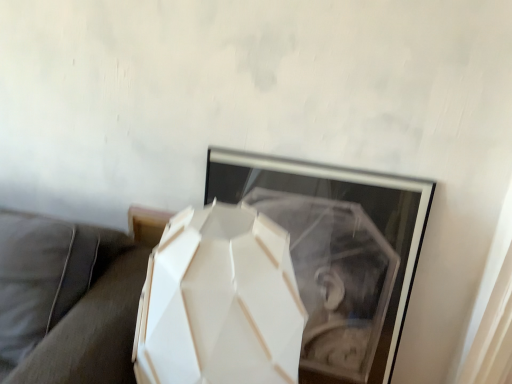
In order to face white matte geometric lamp at center, should I rotate leftwards or rightwards?

A 4.666 degree turn to the left will do.

What is the approximate height of white matte geometric lamp at center?

white matte geometric lamp at center is 36.00 inches tall.

Locate an element on the screen. This screenshot has width=512, height=384. white matte geometric lamp at center is located at coordinates (220, 302).

This screenshot has height=384, width=512. What do you see at coordinates (220, 302) in the screenshot? I see `white matte geometric lamp at center` at bounding box center [220, 302].

This screenshot has width=512, height=384. Describe the element at coordinates (67, 301) in the screenshot. I see `suede gray couch at lower left` at that location.

I want to click on suede gray couch at lower left, so click(67, 301).

Find the location of `white matte geometric lamp at center`. white matte geometric lamp at center is located at coordinates (220, 302).

Considering the positions of objects suede gray couch at lower left and white matte geometric lamp at center in the image provided, who is more to the right, suede gray couch at lower left or white matte geometric lamp at center?

white matte geometric lamp at center is more to the right.

Which object is further away from the camera taking this photo, suede gray couch at lower left or white matte geometric lamp at center?

suede gray couch at lower left is behind.

Does point (58, 382) come in front of point (270, 230)?

No, (58, 382) is behind (270, 230).

From the image's perspective, which object appears higher, suede gray couch at lower left or white matte geometric lamp at center?

From the image's view, white matte geometric lamp at center is above.

From a real-world perspective, does suede gray couch at lower left sit lower than white matte geometric lamp at center?

Yes, from a real-world perspective, suede gray couch at lower left is under white matte geometric lamp at center.

Considering the sizes of objects suede gray couch at lower left and white matte geometric lamp at center in the image provided, who is wider, suede gray couch at lower left or white matte geometric lamp at center?

suede gray couch at lower left.

From the picture: Which of these two, suede gray couch at lower left or white matte geometric lamp at center, stands taller?

With more height is white matte geometric lamp at center.

Which of these two, suede gray couch at lower left or white matte geometric lamp at center, is smaller?

Smaller between the two is white matte geometric lamp at center.

Is suede gray couch at lower left not inside white matte geometric lamp at center?

Yes, suede gray couch at lower left is outside of white matte geometric lamp at center.

Is suede gray couch at lower left not close to white matte geometric lamp at center?

No, there isn't a large distance between suede gray couch at lower left and white matte geometric lamp at center.

Is suede gray couch at lower left turned away from white matte geometric lamp at center?

No.

This screenshot has height=384, width=512. What are the coordinates of `lamp on the right of suede gray couch at lower left` in the screenshot? It's located at (220, 302).

Would you say white matte geometric lamp at center is to the left or to the right of suede gray couch at lower left in the picture?

white matte geometric lamp at center is positioned on suede gray couch at lower left's right side.

Is white matte geometric lamp at center closer to the viewer compared to suede gray couch at lower left?

Yes, it is.

Considering the points (269, 311) and (41, 322), which point is behind, point (269, 311) or point (41, 322)?

Point (41, 322)

Looking at this image, from the image's perspective, relative to suede gray couch at lower left, is white matte geometric lamp at center above or below?

white matte geometric lamp at center is situated higher than suede gray couch at lower left in the image.

Consider the image. From a real-world perspective, is white matte geometric lamp at center beneath suede gray couch at lower left?

Incorrect, from a real-world perspective, white matte geometric lamp at center is higher than suede gray couch at lower left.

Does white matte geometric lamp at center have a greater width compared to suede gray couch at lower left?

No, white matte geometric lamp at center is not wider than suede gray couch at lower left.

In terms of height, does white matte geometric lamp at center look taller or shorter compared to suede gray couch at lower left?

Considering their sizes, white matte geometric lamp at center has more height than suede gray couch at lower left.

Looking at the image, does white matte geometric lamp at center seem bigger or smaller compared to suede gray couch at lower left?

In the image, white matte geometric lamp at center appears to be smaller than suede gray couch at lower left.

Is white matte geometric lamp at center situated inside suede gray couch at lower left or outside?

white matte geometric lamp at center lies outside suede gray couch at lower left.

In the scene shown: Is white matte geometric lamp at center positioned far away from suede gray couch at lower left?

white matte geometric lamp at center is actually quite close to suede gray couch at lower left.

Is white matte geometric lamp at center facing towards suede gray couch at lower left?

No, white matte geometric lamp at center is not facing towards suede gray couch at lower left.

What's the angular difference between white matte geometric lamp at center and suede gray couch at lower left's facing directions?

The angle between the facing direction of white matte geometric lamp at center and the facing direction of suede gray couch at lower left is 1.26 degrees.

The height and width of the screenshot is (384, 512). I want to click on lamp that appears in front of the suede gray couch at lower left, so tap(220, 302).

The width and height of the screenshot is (512, 384). I want to click on lamp that appears in front of the suede gray couch at lower left, so [220, 302].

At what (x,y) coordinates should I click in order to perform the action: click on lamp above the suede gray couch at lower left (from the image's perspective). Please return your answer as a coordinate pair (x, y). Looking at the image, I should click on (220, 302).